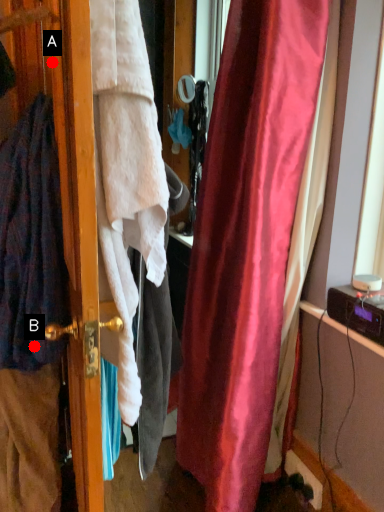
Question: Two points are circled on the image, labeled by A and B beside each circle. Which point is closer to the camera taking this photo?

Choices:
 (A) A is closer
 (B) B is closer

Answer: (A)